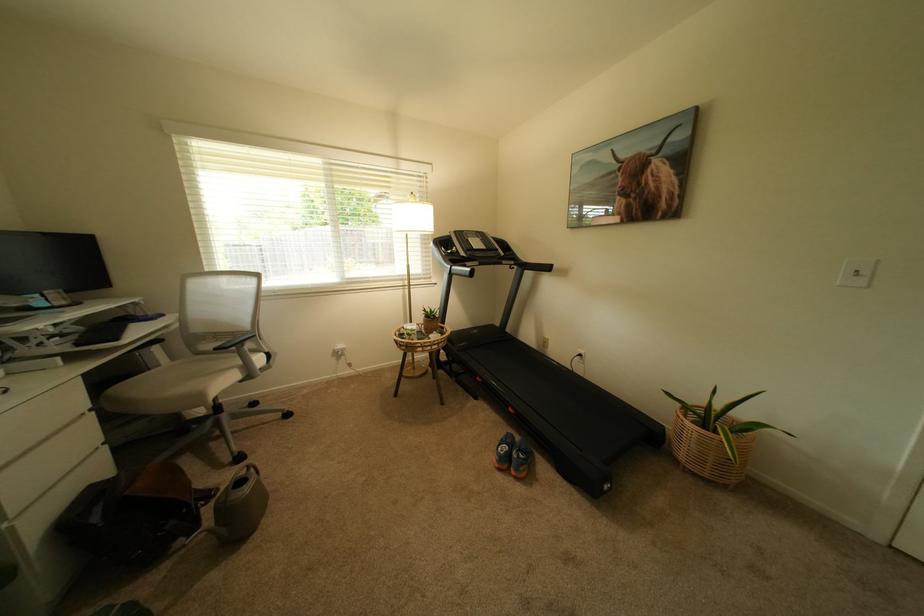
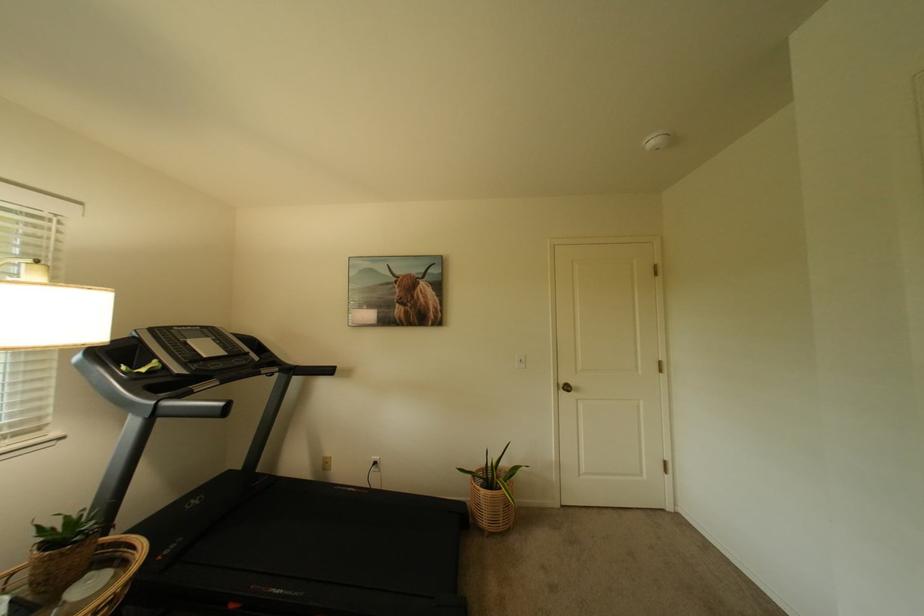
In the second image, find the point that corresponds to point 438,339 in the first image.

(73, 605)